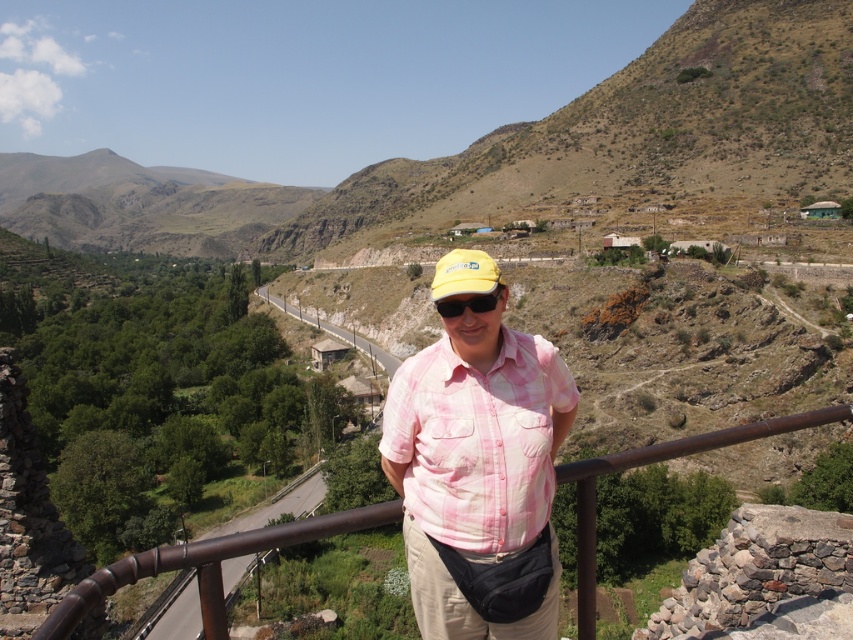
You are a photographer trying to capture the pink plaid shirt at center in your shot. The camera you are using has a focal length of 50mm. If you want to ensure the shirt is in the center of the frame, where should you aim the camera?

The pink plaid shirt at center is already located at the center point of the image coordinates at position [479,476], so you should aim the camera directly at that point to ensure the shirt is centered in the frame.

You are standing at the point marked as point (206, 564). What is the nearest object to you?

The nearest object to you is the brown metal rail at center, as point (206, 564) is located on it.